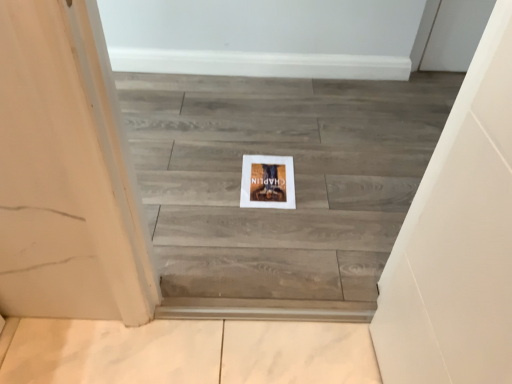
What is the approximate width of white paper at center?

white paper at center is 12.03 inches in width.

What do you see at coordinates (267, 182) in the screenshot? The image size is (512, 384). I see `white paper at center` at bounding box center [267, 182].

You are a GUI agent. You are given a task and a screenshot of the screen. Output one action in this format:
    pyautogui.click(x=<x>, y=<y>)
    Task: Click on the white paper at center
    This screenshot has width=512, height=384.
    Given the screenshot: What is the action you would take?
    pyautogui.click(x=267, y=182)

Identify the location of white paper at center. The width and height of the screenshot is (512, 384). (267, 182).